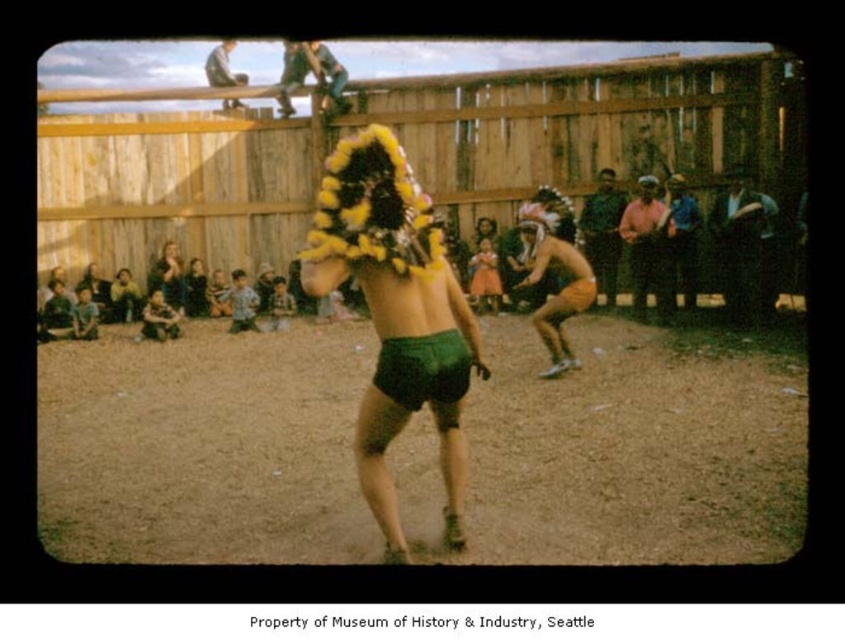
You are observing a traditional dance performance at the Museum of History and Industry in Seattle. There are two dancers in front of you. One is wearing a large yellow feathered headdress and green matte shorts at center. The other dancer has orange shorts. Based on their positions, which dancer is closer to the center of the scene?

The dancer wearing the green matte shorts at center is positioned exactly at the center coordinates of the scene, so they are closer to the center than the other dancer with orange shorts.

You are a photographer at the event and want to capture a photo where both the green matte shorts at center and the dark brown leather jacket at right are in focus. Since you know the height difference between them, which object should you focus on to ensure both are sharp?

The green matte shorts at center is taller than the dark brown leather jacket at right. To ensure both are in focus, focus on the green matte shorts at center as it is the taller object, allowing the depth of field to cover the shorter dark brown leather jacket at right.

You are a photographer at the event and want to capture both the green matte shorts at center and the matte black dress at lower left in a single shot. Which object should you focus on first to ensure both are in frame?

The green matte shorts at center is much taller than the matte black dress at lower left, so you should focus on the green matte shorts at center first to ensure both are in frame.